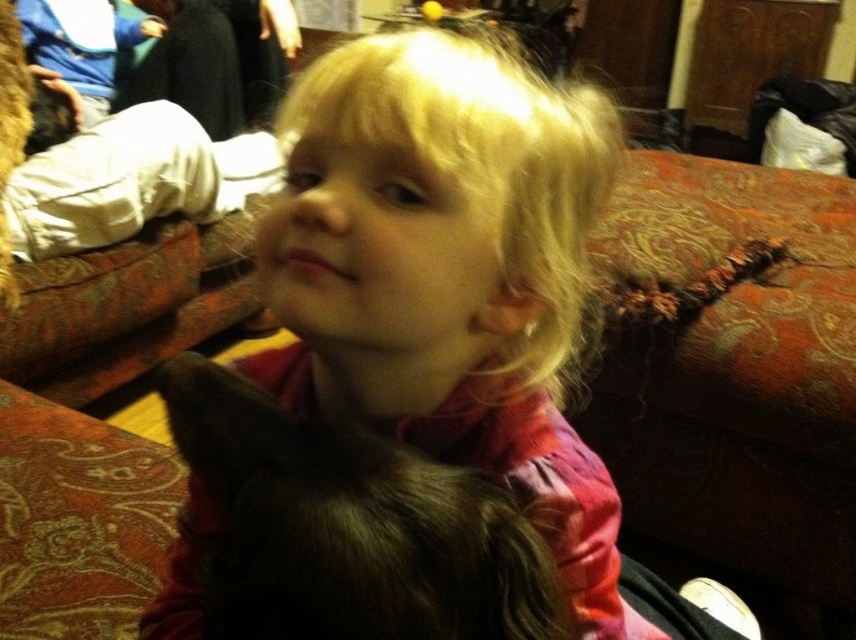
You are a photographer trying to capture the child in the scene. The child is wearing a smooth pink shirt at center and there is a dark fur cat at center nearby. Which object is on the left side when looking at the scene?

The dark fur cat at center is on the left side because the smooth pink shirt at center is positioned to its right.

You are holding a small toy that is 4 inches wide. You want to place it exactly at the point marked as point (337,129) in the image. Will the toy fit entirely within the space at that point without overlapping any objects?

The point (337,129) is 16.06 inches away from the viewer. Since the toy is only 4 inches wide, it will fit within the space at that point without overlapping any objects as there is sufficient distance and no obstruction mentioned.

You are a photographer trying to capture the smooth pink shirt at center and the dark fur cat at center in a single shot. Which object is closer to your camera lens?

The smooth pink shirt at center is closer to the camera lens since it is positioned further to the viewer compared to the dark fur cat at center.